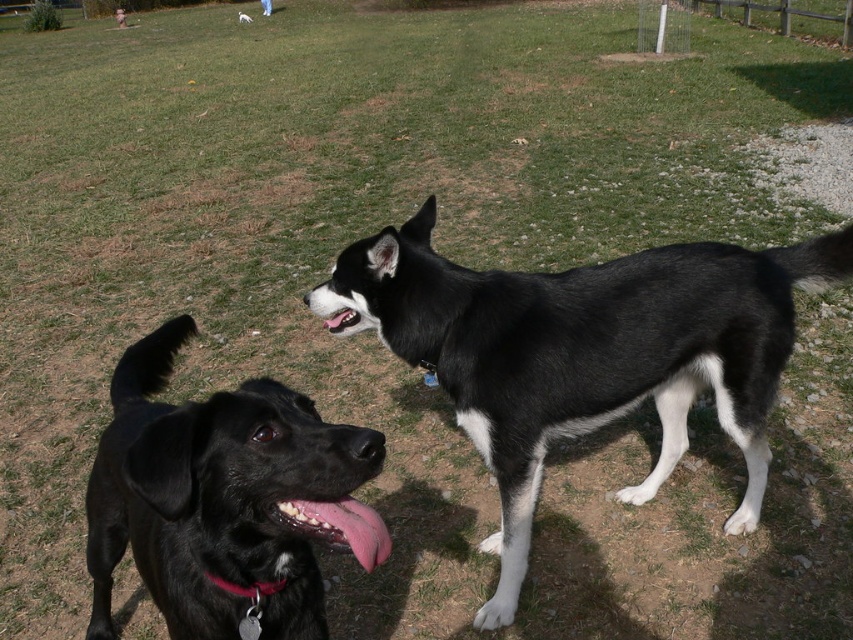
Who is positioned more to the right, pink glossy tongue at lower center or black matte dog at center?

pink glossy tongue at lower center is more to the right.

Can you confirm if pink glossy tongue at lower center is positioned to the right of black matte dog at center?

Yes, pink glossy tongue at lower center is to the right of black matte dog at center.

Is point (347, 541) more distant than point (242, 13)?

No, it is not.

Where is `pink glossy tongue at lower center`? The image size is (853, 640). pink glossy tongue at lower center is located at coordinates (343, 525).

Is black matte dog at lower left to the left of black glossy teeth at center from the viewer's perspective?

Indeed, black matte dog at lower left is positioned on the left side of black glossy teeth at center.

Is point (326, 508) more distant than point (329, 317)?

No, it is in front of (329, 317).

At what (x,y) coordinates should I click in order to perform the action: click on black matte dog at lower left. Please return your answer as a coordinate pair (x, y). The height and width of the screenshot is (640, 853). Looking at the image, I should click on (223, 499).

Does black/white fur dog at center have a greater width compared to black glossy dog at center?

Indeed, black/white fur dog at center has a greater width compared to black glossy dog at center.

Between black/white fur dog at center and black glossy dog at center, which one appears on the left side from the viewer's perspective?

black glossy dog at center

Identify the location of black/white fur dog at center. The width and height of the screenshot is (853, 640). (585, 353).

You are a GUI agent. You are given a task and a screenshot of the screen. Output one action in this format:
    pyautogui.click(x=<x>, y=<y>)
    Task: Click on the black/white fur dog at center
    
    Given the screenshot: What is the action you would take?
    pyautogui.click(x=585, y=353)